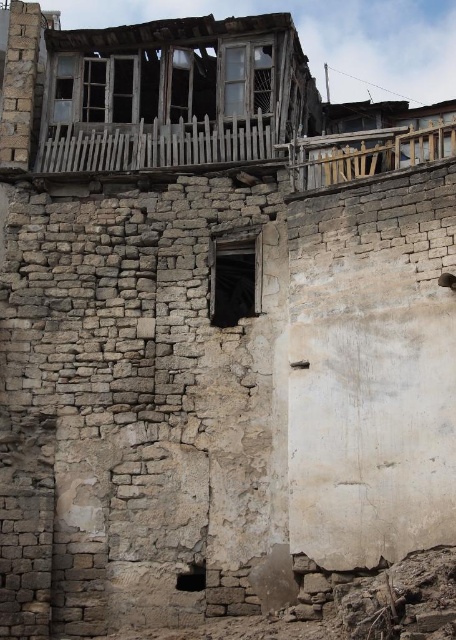
Question: Is transparent glass window at center thinner than transparent glass window at upper center?

Choices:
 (A) yes
 (B) no

Answer: (B)

Question: Which point is closer to the camera?

Choices:
 (A) transparent glass window at center
 (B) transparent glass window at upper center

Answer: (A)

Question: Is transparent glass window at center to the left of transparent glass window at upper center from the viewer's perspective?

Choices:
 (A) no
 (B) yes

Answer: (B)

Question: Does transparent glass window at center have a larger size compared to transparent glass window at upper center?

Choices:
 (A) yes
 (B) no

Answer: (A)

Question: Which object is closer to the camera taking this photo?

Choices:
 (A) transparent glass window at upper center
 (B) transparent glass window at center

Answer: (B)